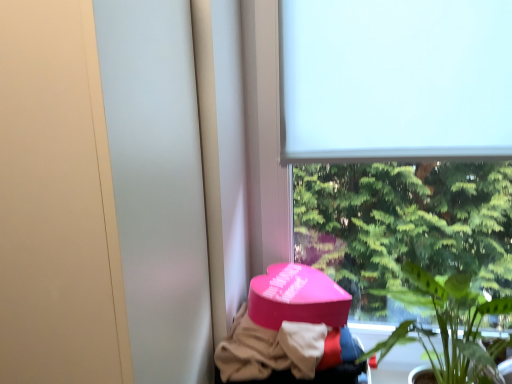
Question: Would you say green leafy plant at lower right is a long distance from pink matte heart-shaped box at lower center?

Choices:
 (A) no
 (B) yes

Answer: (A)

Question: From the image's perspective, is green leafy plant at lower right above pink matte heart-shaped box at lower center?

Choices:
 (A) no
 (B) yes

Answer: (B)

Question: Could pink matte heart-shaped box at lower center be considered to be inside green leafy plant at lower right?

Choices:
 (A) yes
 (B) no

Answer: (B)

Question: From the image's perspective, does green leafy plant at lower right appear lower than pink matte heart-shaped box at lower center?

Choices:
 (A) no
 (B) yes

Answer: (A)

Question: Is green leafy plant at lower right to the right of pink matte heart-shaped box at lower center from the viewer's perspective?

Choices:
 (A) yes
 (B) no

Answer: (A)

Question: Based on their positions, is white matte window at upper center located to the left or right of green leafy plant at lower right?

Choices:
 (A) left
 (B) right

Answer: (A)

Question: From the image's perspective, relative to green leafy plant at lower right, is white matte window at upper center above or below?

Choices:
 (A) above
 (B) below

Answer: (A)

Question: Is white matte window at upper center situated inside green leafy plant at lower right or outside?

Choices:
 (A) outside
 (B) inside

Answer: (A)

Question: Looking at their shapes, would you say white matte window at upper center is wider or thinner than green leafy plant at lower right?

Choices:
 (A) thin
 (B) wide

Answer: (A)

Question: Is green leafy plant at lower right taller or shorter than white matte window at upper center?

Choices:
 (A) tall
 (B) short

Answer: (B)

Question: From the image's perspective, relative to white matte window at upper center, is green leafy plant at lower right above or below?

Choices:
 (A) above
 (B) below

Answer: (B)

Question: Relative to white matte window at upper center, is green leafy plant at lower right in front or behind?

Choices:
 (A) front
 (B) behind

Answer: (A)

Question: From a real-world perspective, is green leafy plant at lower right positioned above or below white matte window at upper center?

Choices:
 (A) below
 (B) above

Answer: (A)

Question: Is pink matte heart-shaped box at lower center taller or shorter than white matte window at upper center?

Choices:
 (A) short
 (B) tall

Answer: (A)

Question: Does point (285, 324) appear closer or farther from the camera than point (380, 21)?

Choices:
 (A) farther
 (B) closer

Answer: (B)